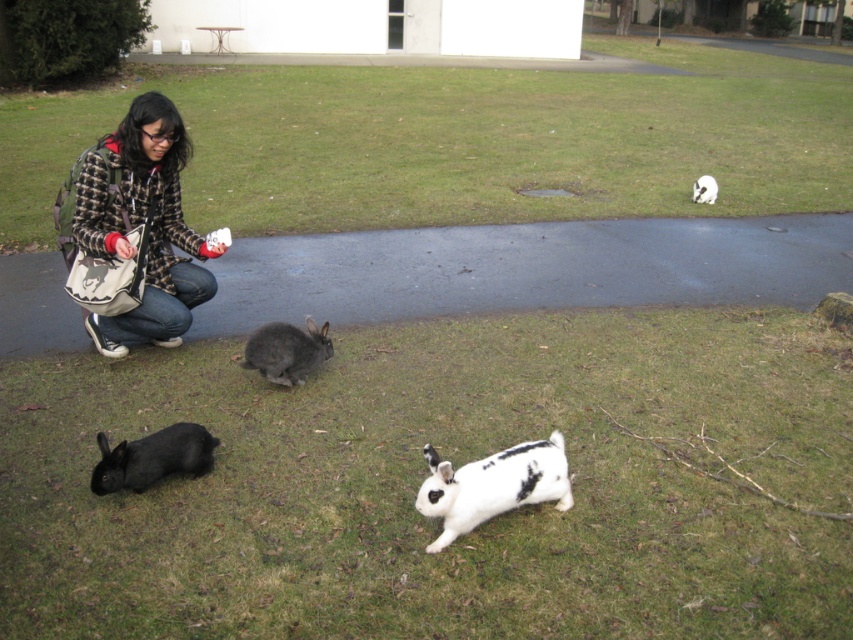
Question: Is white speckled fur rabbit at lower center below white soft fur rabbit at center?

Choices:
 (A) yes
 (B) no

Answer: (A)

Question: Which of the following is the farthest from the observer?

Choices:
 (A) white speckled fur rabbit at lower center
 (B) green grass at upper center

Answer: (B)

Question: Can you confirm if plaid wool jacket at left is positioned below white soft fur rabbit at center?

Choices:
 (A) yes
 (B) no

Answer: (A)

Question: Which object appears farthest from the camera in this image?

Choices:
 (A) black fur rabbit at lower left
 (B) plaid wool jacket at left

Answer: (B)

Question: Which object appears farthest from the camera in this image?

Choices:
 (A) black fur rabbit at lower left
 (B) dark gray fur rabbit at center

Answer: (B)

Question: Observing the image, what is the correct spatial positioning of green grass at upper center in reference to white speckled fur rabbit at lower center?

Choices:
 (A) right
 (B) left

Answer: (A)